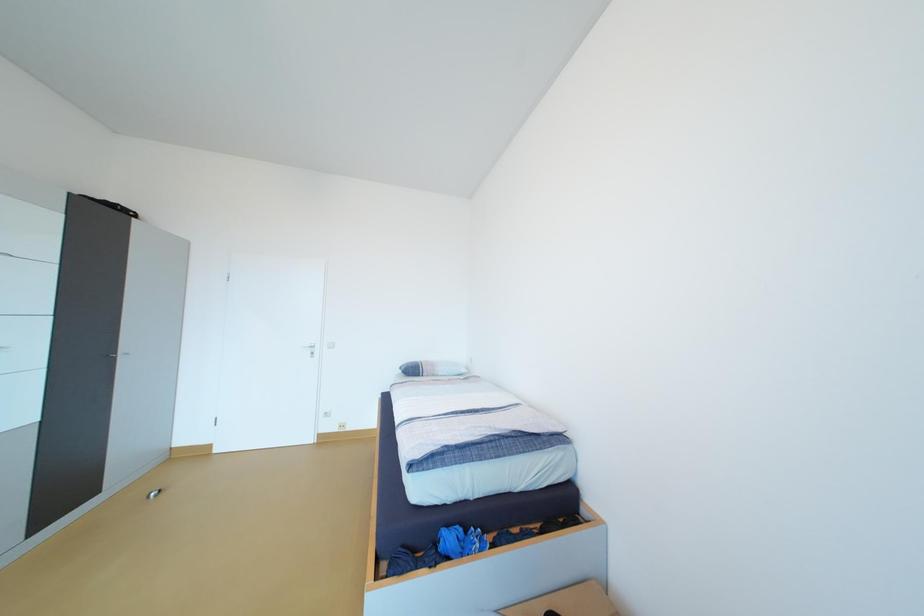
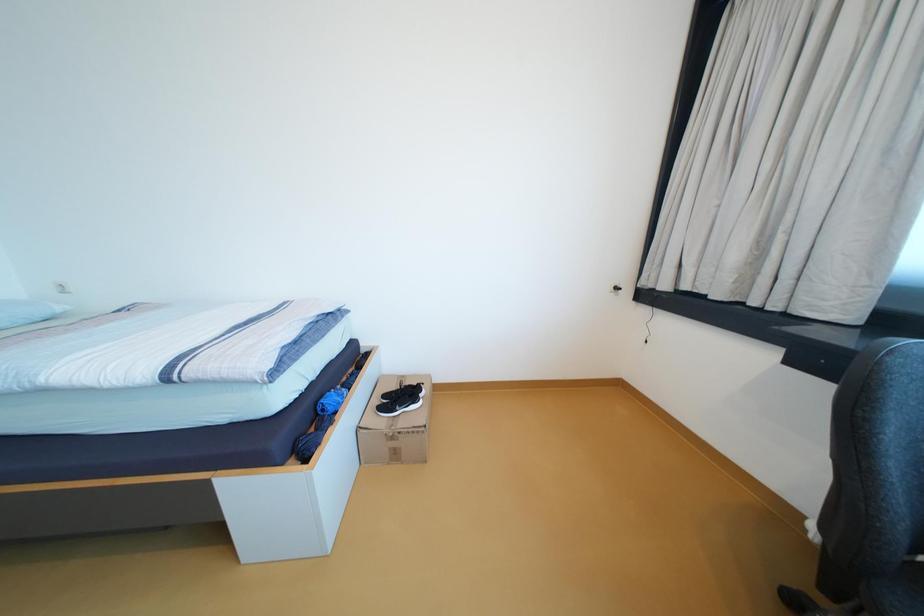
Based on the continuous images, in which direction is the camera rotating?

The camera's rotation is toward right-down.